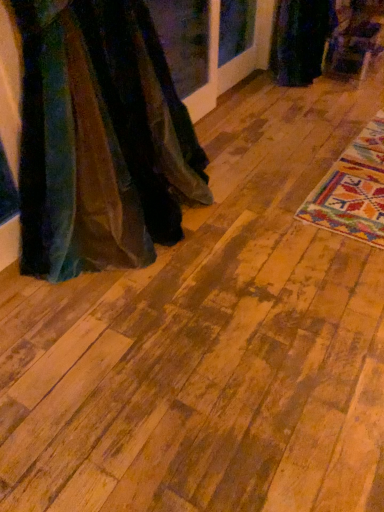
What do you see at coordinates (99, 139) in the screenshot? I see `velvet fabric dress at left, the first fancy dress viewed from the front` at bounding box center [99, 139].

This screenshot has height=512, width=384. What do you see at coordinates (204, 380) in the screenshot?
I see `wooden floor at center` at bounding box center [204, 380].

What is the approximate height of wooden floor at center?

The height of wooden floor at center is 3.72 inches.

Find the location of `velvet dark green dress at upper right, the 1th fancy dress when ordered from back to front`. velvet dark green dress at upper right, the 1th fancy dress when ordered from back to front is located at coordinates [300, 40].

Considering the relative sizes of velvet dark green dress at upper right, the 1th fancy dress when ordered from right to left, and velvet fabric dress at left, the first fancy dress viewed from the front, in the image provided, is velvet dark green dress at upper right, the 1th fancy dress when ordered from right to left, bigger than velvet fabric dress at left, the first fancy dress viewed from the front,?

No.

Which of these two, velvet dark green dress at upper right, the 1th fancy dress when ordered from back to front, or velvet fabric dress at left, the second fancy dress from the top, is wider?

velvet fabric dress at left, the second fancy dress from the top, is wider.

Between velvet dark green dress at upper right, marked as the second fancy dress in a bottom-to-top arrangement, and velvet fabric dress at left, which is the 2th fancy dress in back-to-front order, which one has less height?

velvet dark green dress at upper right, marked as the second fancy dress in a bottom-to-top arrangement.

Find the location of `fancy dress below the velvet dark green dress at upper right, the 1th fancy dress when ordered from back to front (from the image's perspective)`. fancy dress below the velvet dark green dress at upper right, the 1th fancy dress when ordered from back to front (from the image's perspective) is located at coordinates (99, 139).

Is wooden floor at center at the right side of velvet dark green dress at upper right, marked as the second fancy dress in a bottom-to-top arrangement?

Correct, you'll find wooden floor at center to the right of velvet dark green dress at upper right, marked as the second fancy dress in a bottom-to-top arrangement.

From the picture: Considering the relative sizes of wooden floor at center and velvet dark green dress at upper right, the 1th fancy dress when ordered from right to left, in the image provided, is wooden floor at center smaller than velvet dark green dress at upper right, the 1th fancy dress when ordered from right to left,?

No, wooden floor at center is not smaller than velvet dark green dress at upper right, the 1th fancy dress when ordered from right to left.

From a real-world perspective, who is located higher, wooden floor at center or velvet dark green dress at upper right, acting as the 2th fancy dress starting from the left?

In real-world perspective, velvet dark green dress at upper right, acting as the 2th fancy dress starting from the left, is above.

From a real-world perspective, is wooden floor at center above or below velvet fabric dress at left, placed as the 1th fancy dress when sorted from left to right?

wooden floor at center is below velvet fabric dress at left, placed as the 1th fancy dress when sorted from left to right.

Is wooden floor at center surrounding velvet fabric dress at left, the second fancy dress when ordered from right to left?

No, velvet fabric dress at left, the second fancy dress when ordered from right to left, is not a part of wooden floor at center.

Between wooden floor at center and velvet fabric dress at left, the second fancy dress when ordered from right to left, which one appears on the left side from the viewer's perspective?

velvet fabric dress at left, the second fancy dress when ordered from right to left, is more to the left.

Does wooden floor at center touch velvet fabric dress at left, the second fancy dress when ordered from right to left?

They are not placed beside each other.

Considering the relative sizes of velvet fabric dress at left, the second fancy dress when ordered from right to left, and velvet dark green dress at upper right, marked as the second fancy dress in a bottom-to-top arrangement, in the image provided, is velvet fabric dress at left, the second fancy dress when ordered from right to left, bigger than velvet dark green dress at upper right, marked as the second fancy dress in a bottom-to-top arrangement,?

Yes, velvet fabric dress at left, the second fancy dress when ordered from right to left, is bigger than velvet dark green dress at upper right, marked as the second fancy dress in a bottom-to-top arrangement.

From the image's perspective, does velvet fabric dress at left, which is the 2th fancy dress in back-to-front order, appear lower than velvet dark green dress at upper right, the second fancy dress in the front-to-back sequence?

Correct, velvet fabric dress at left, which is the 2th fancy dress in back-to-front order, appears lower than velvet dark green dress at upper right, the second fancy dress in the front-to-back sequence, in the image.

Does point (54, 12) lie behind point (290, 15)?

No, it is not.

In the scene shown: Which of these two, velvet fabric dress at left, which is the 2th fancy dress in back-to-front order, or velvet dark green dress at upper right, the 1th fancy dress when ordered from back to front, is thinner?

velvet dark green dress at upper right, the 1th fancy dress when ordered from back to front, is thinner.

Considering the sizes of objects velvet dark green dress at upper right, marked as the second fancy dress in a bottom-to-top arrangement, and wooden floor at center in the image provided, who is wider, velvet dark green dress at upper right, marked as the second fancy dress in a bottom-to-top arrangement, or wooden floor at center?

wooden floor at center.

Based on the photo, is velvet dark green dress at upper right, the second fancy dress in the front-to-back sequence, facing towards wooden floor at center?

Yes.

How far apart are velvet dark green dress at upper right, the 1th fancy dress when ordered from back to front, and wooden floor at center?

velvet dark green dress at upper right, the 1th fancy dress when ordered from back to front, is 2.56 meters from wooden floor at center.

Is velvet dark green dress at upper right, the 1th fancy dress when ordered from back to front, far from wooden floor at center?

Indeed, velvet dark green dress at upper right, the 1th fancy dress when ordered from back to front, is not near wooden floor at center.

From a real-world perspective, which is physically above, velvet fabric dress at left, the second fancy dress when ordered from right to left, or wooden floor at center?

In real-world perspective, velvet fabric dress at left, the second fancy dress when ordered from right to left, is above.

Is velvet fabric dress at left, the second fancy dress when ordered from right to left, outside of wooden floor at center?

velvet fabric dress at left, the second fancy dress when ordered from right to left, lies outside wooden floor at center's area.

Is velvet fabric dress at left, placed as the 1th fancy dress when sorted from left to right, aimed at wooden floor at center?

No, velvet fabric dress at left, placed as the 1th fancy dress when sorted from left to right, is not aimed at wooden floor at center.

This screenshot has height=512, width=384. I want to click on fancy dress that is behind the velvet fabric dress at left, the first fancy dress viewed from the front, so click(x=300, y=40).

Locate an element on the screen. Image resolution: width=384 pixels, height=512 pixels. plywood that appears in front of the velvet dark green dress at upper right, the 1th fancy dress when ordered from right to left is located at coordinates (204, 380).

When comparing their distances from velvet fabric dress at left, the first fancy dress viewed from the front, does velvet dark green dress at upper right, the 1th fancy dress when ordered from right to left, or wooden floor at center seem closer?

wooden floor at center is closer to velvet fabric dress at left, the first fancy dress viewed from the front.

Based on their spatial positions, is velvet fabric dress at left, the second fancy dress when ordered from right to left, or wooden floor at center closer to velvet dark green dress at upper right, the second fancy dress in the front-to-back sequence?

The object closer to velvet dark green dress at upper right, the second fancy dress in the front-to-back sequence, is velvet fabric dress at left, the second fancy dress when ordered from right to left.

Estimate the real-world distances between objects in this image. Which object is closer to velvet dark green dress at upper right, marked as the second fancy dress in a bottom-to-top arrangement, wooden floor at center or velvet fabric dress at left, the second fancy dress when ordered from right to left?

velvet fabric dress at left, the second fancy dress when ordered from right to left, lies closer to velvet dark green dress at upper right, marked as the second fancy dress in a bottom-to-top arrangement, than the other object.

Based on their spatial positions, is velvet fabric dress at left, which appears as the 1th fancy dress when ordered from the bottom, or velvet dark green dress at upper right, marked as the second fancy dress in a bottom-to-top arrangement, further from wooden floor at center?

Based on the image, velvet dark green dress at upper right, marked as the second fancy dress in a bottom-to-top arrangement, appears to be further to wooden floor at center.

From the image, which object appears to be nearer to wooden floor at center, velvet dark green dress at upper right, acting as the 2th fancy dress starting from the left, or velvet fabric dress at left, which appears as the 1th fancy dress when ordered from the bottom?

velvet fabric dress at left, which appears as the 1th fancy dress when ordered from the bottom.

Looking at the image, which one is located closer to velvet fabric dress at left, placed as the 1th fancy dress when sorted from left to right, wooden floor at center or velvet dark green dress at upper right, acting as the 2th fancy dress starting from the left?

wooden floor at center is positioned closer to the anchor velvet fabric dress at left, placed as the 1th fancy dress when sorted from left to right.

Identify the location of fancy dress located between wooden floor at center and velvet dark green dress at upper right, marked as the second fancy dress in a bottom-to-top arrangement, in the depth direction. This screenshot has width=384, height=512. (99, 139).